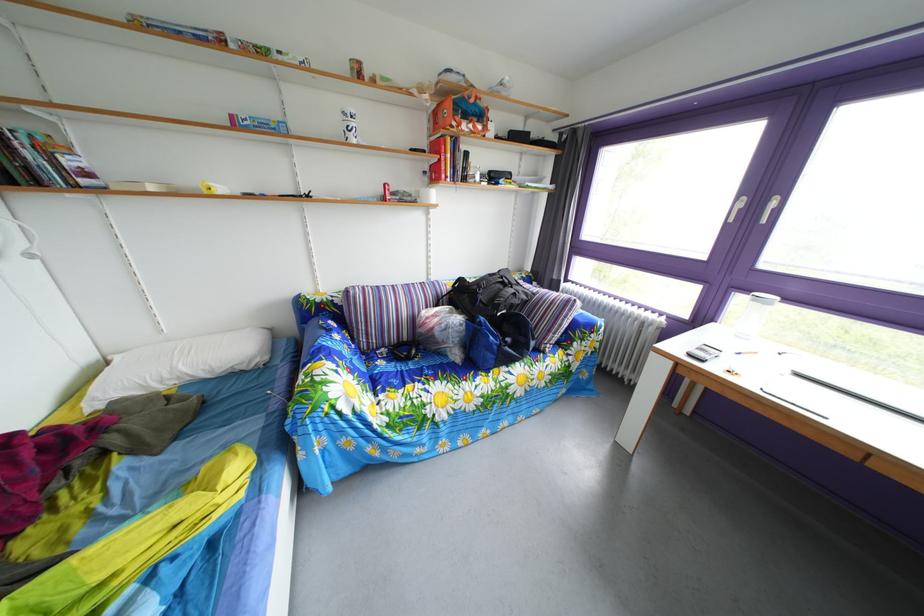
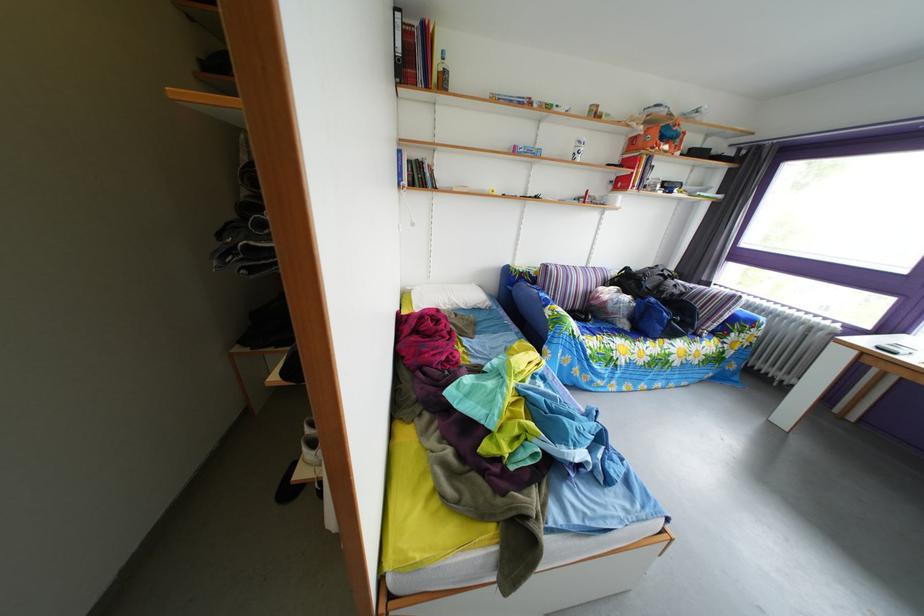
Where in the second image is the point corresponding to (x=492, y=328) from the first image?

(663, 307)